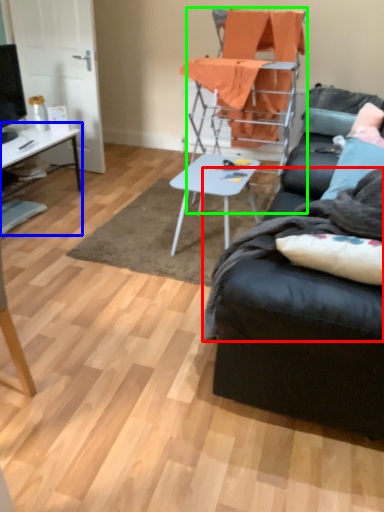
Question: Considering the real-world distances, which object is closest to blanket (highlighted by a red box)? desk (highlighted by a blue box) or chair (highlighted by a green box).

Choices:
 (A) desk
 (B) chair

Answer: (B)